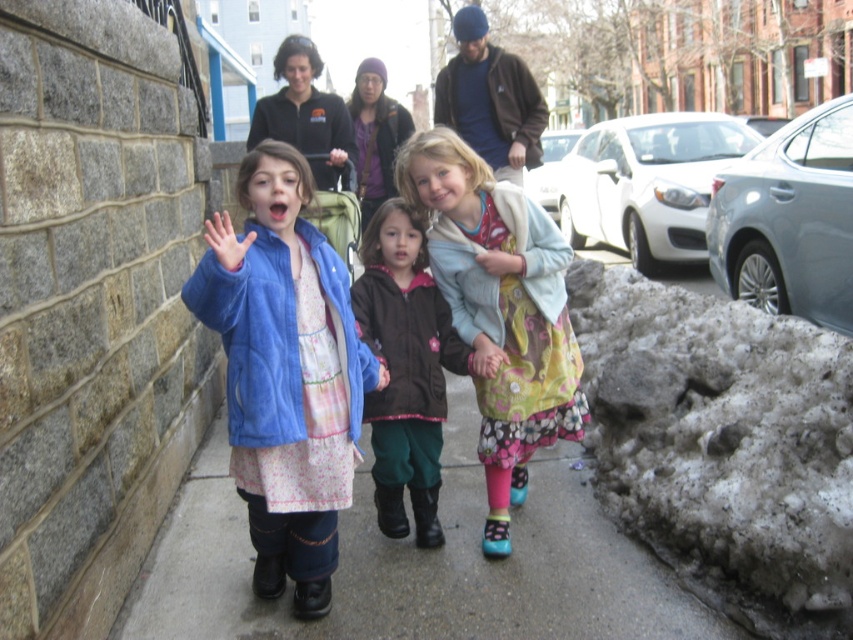
You are a photographer standing on the sidewalk trying to capture a photo of the floral dress at center without including the smooth concrete sidewalk at center in the frame. Based on their distance, is this possible?

The smooth concrete sidewalk at center and floral dress at center are 28.55 inches apart. Since the distance between them is relatively small, it might be challenging to frame the photo so that the floral dress at center is visible without including the smooth concrete sidewalk at center in the shot.

You are a photographer standing on the sidewalk. You want to take a photo of the floral fabric dress at center without the smooth concrete sidewalk at center appearing in the foreground. Is this possible?

The smooth concrete sidewalk at center is in front of the floral fabric dress at center, so the sidewalk would block the view of the dress. Therefore, it is not possible to take a photo of the floral fabric dress at center without the sidewalk appearing in the foreground.

You are a photographer trying to capture the matte blue jacket at center and the floral dress at center in the same frame. Based on their positions, which one is closer to the camera?

The matte blue jacket at center is in front of the floral dress at center, so it is closer to the camera.